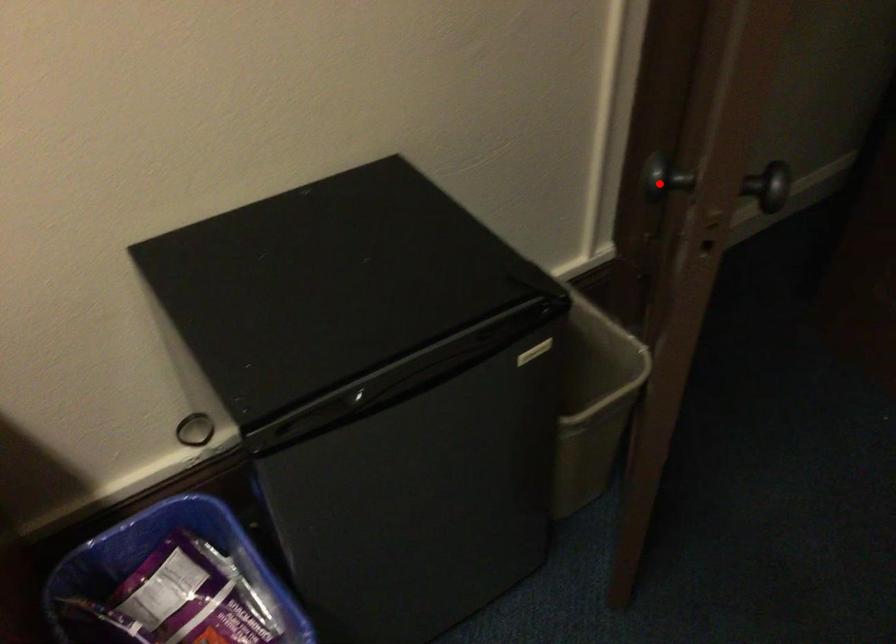
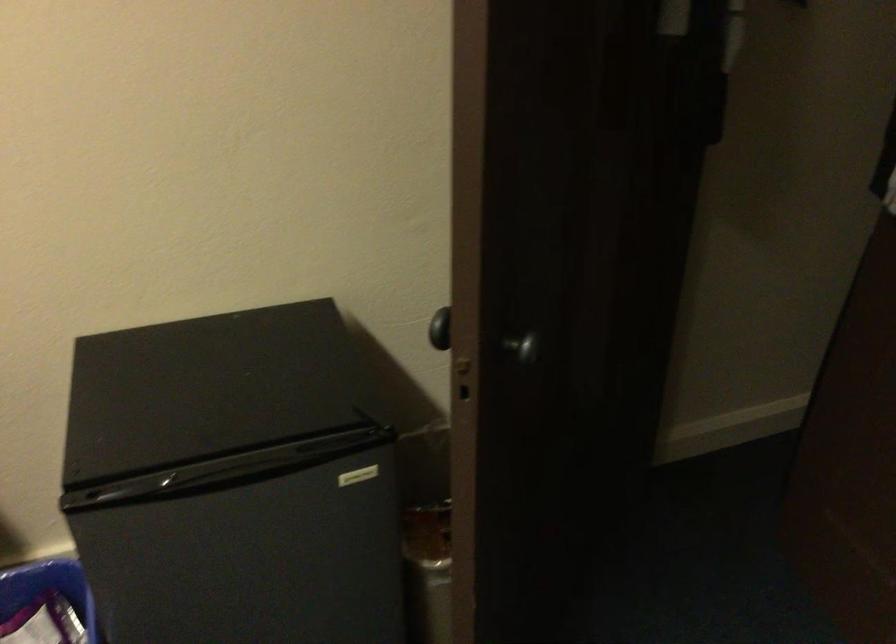
Question: I am providing you with two images of the same scene from different viewpoints. A red point is shown in image1. For the corresponding object point in image2, is it positioned nearer or farther from the camera?

Choices:
 (A) Nearer
 (B) Farther

Answer: (B)